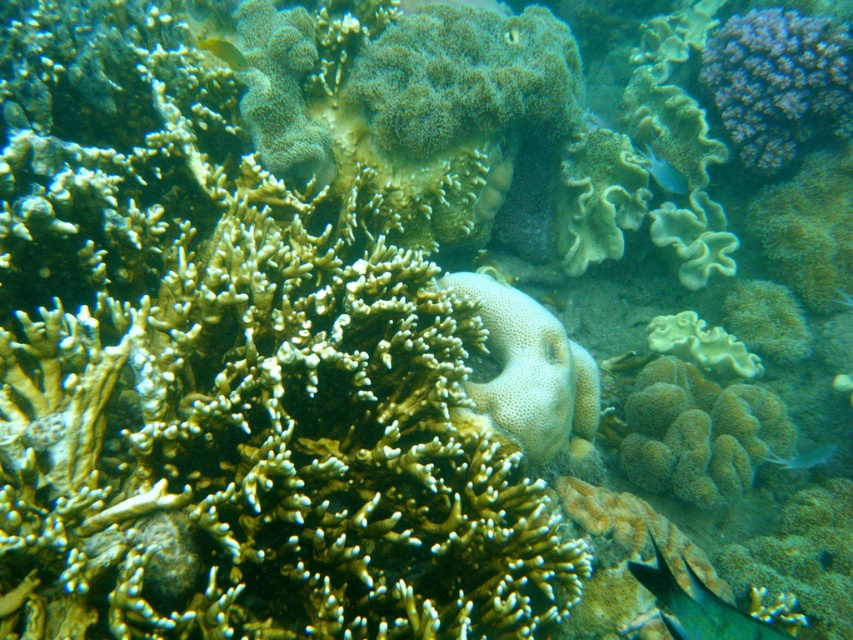
Who is positioned more to the left, purple coral at upper right or shiny blue fish at lower right?

Positioned to the left is shiny blue fish at lower right.

Is purple coral at upper right bigger than shiny blue fish at lower right?

Yes.

Is point (770, 124) less distant than point (776, 461)?

No, it is not.

This screenshot has height=640, width=853. Identify the location of purple coral at upper right. [779, 81].

Does purple coral at upper right appear on the right side of yellow matte fish at upper left?

Correct, you'll find purple coral at upper right to the right of yellow matte fish at upper left.

Where is `purple coral at upper right`? Image resolution: width=853 pixels, height=640 pixels. purple coral at upper right is located at coordinates (779, 81).

Is purple coral at upper right positioned in front of green matte fish at lower right?

No.

Describe the element at coordinates (779, 81) in the screenshot. I see `purple coral at upper right` at that location.

Is point (733, 132) behind point (720, 627)?

That is True.

This screenshot has width=853, height=640. Find the location of `purple coral at upper right`. purple coral at upper right is located at coordinates (779, 81).